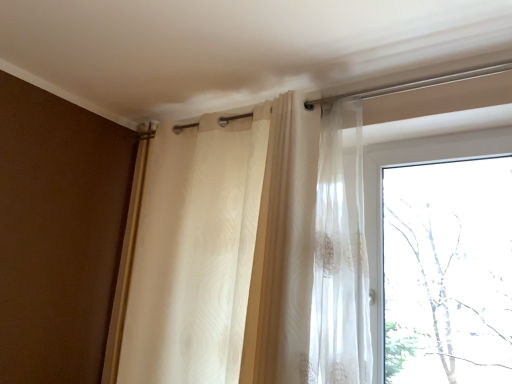
What do you see at coordinates (252, 252) in the screenshot?
I see `translucent fabric curtain at upper center` at bounding box center [252, 252].

I want to click on translucent fabric curtain at upper center, so click(252, 252).

This screenshot has height=384, width=512. Describe the element at coordinates (435, 104) in the screenshot. I see `transparent glass window at upper right` at that location.

This screenshot has width=512, height=384. Find the location of `transparent glass window at upper right`. transparent glass window at upper right is located at coordinates (435, 104).

Identify the location of translucent fabric curtain at upper center. This screenshot has width=512, height=384. (252, 252).

Considering the relative positions of transparent glass window at upper right and translucent fabric curtain at upper center in the image provided, is transparent glass window at upper right to the left or to the right of translucent fabric curtain at upper center?

Clearly, transparent glass window at upper right is on the right of translucent fabric curtain at upper center in the image.

Looking at this image, between transparent glass window at upper right and translucent fabric curtain at upper center, which one is positioned in front?

translucent fabric curtain at upper center is more forward.

Which is less distant, (421,85) or (292,179)?

Point (421,85) is farther from the camera than point (292,179).

From the image's perspective, is transparent glass window at upper right above translucent fabric curtain at upper center?

No, from the image's perspective, transparent glass window at upper right is not over translucent fabric curtain at upper center.

Looking at this image, from a real-world perspective, is transparent glass window at upper right above or below translucent fabric curtain at upper center?

transparent glass window at upper right is situated higher than translucent fabric curtain at upper center in the real world.

Is transparent glass window at upper right thinner than translucent fabric curtain at upper center?

Correct, the width of transparent glass window at upper right is less than that of translucent fabric curtain at upper center.

Between transparent glass window at upper right and translucent fabric curtain at upper center, which one has less height?

transparent glass window at upper right is shorter.

Which of these two, transparent glass window at upper right or translucent fabric curtain at upper center, is bigger?

translucent fabric curtain at upper center is bigger.

Can we say transparent glass window at upper right lies outside translucent fabric curtain at upper center?

transparent glass window at upper right lies outside translucent fabric curtain at upper center's area.

Is transparent glass window at upper right next to translucent fabric curtain at upper center and touching it?

transparent glass window at upper right is not next to translucent fabric curtain at upper center, and they're not touching.

Is transparent glass window at upper right facing away from translucent fabric curtain at upper center?

No, transparent glass window at upper right is not facing the opposite direction of translucent fabric curtain at upper center.

What's the angular difference between transparent glass window at upper right and translucent fabric curtain at upper center's facing directions?

1.06 degrees.

Find the location of a particular element. curtain located underneath the transparent glass window at upper right (from a real-world perspective) is located at coordinates point(252,252).

Which object is positioned more to the right, translucent fabric curtain at upper center or transparent glass window at upper right?

From the viewer's perspective, transparent glass window at upper right appears more on the right side.

Is translucent fabric curtain at upper center further to the viewer compared to transparent glass window at upper right?

No, translucent fabric curtain at upper center is closer to the camera.

Which is closer, (313, 188) or (495, 64)?

The point (495, 64) is in front.

From the picture: From the image's perspective, is translucent fabric curtain at upper center located above or below transparent glass window at upper right?

translucent fabric curtain at upper center is above transparent glass window at upper right.

From a real-world perspective, is translucent fabric curtain at upper center over transparent glass window at upper right?

No.

In terms of width, does translucent fabric curtain at upper center look wider or thinner when compared to transparent glass window at upper right?

In the image, translucent fabric curtain at upper center appears to be wider than transparent glass window at upper right.

Is translucent fabric curtain at upper center taller than transparent glass window at upper right?

Yes, translucent fabric curtain at upper center is taller than transparent glass window at upper right.

Is translucent fabric curtain at upper center bigger or smaller than transparent glass window at upper right?

In the image, translucent fabric curtain at upper center appears to be larger than transparent glass window at upper right.

Is translucent fabric curtain at upper center located outside transparent glass window at upper right?

Yes.

Is translucent fabric curtain at upper center next to transparent glass window at upper right?

translucent fabric curtain at upper center and transparent glass window at upper right are clearly separated.

Does translucent fabric curtain at upper center turn towards transparent glass window at upper right?

No, translucent fabric curtain at upper center is not aimed at transparent glass window at upper right.

How many degrees apart are the facing directions of translucent fabric curtain at upper center and transparent glass window at upper right?

The facing directions of translucent fabric curtain at upper center and transparent glass window at upper right are 1.06 degrees apart.

In order to click on window behind the translucent fabric curtain at upper center in this screenshot , I will do `click(435, 104)`.

You are a GUI agent. You are given a task and a screenshot of the screen. Output one action in this format:
    pyautogui.click(x=<x>, y=<y>)
    Task: Click on the curtain below the transparent glass window at upper right (from a real-world perspective)
    
    Given the screenshot: What is the action you would take?
    pyautogui.click(x=252, y=252)

Find the location of a particular element. Image resolution: width=512 pixels, height=384 pixels. window behind the translucent fabric curtain at upper center is located at coordinates (x=435, y=104).